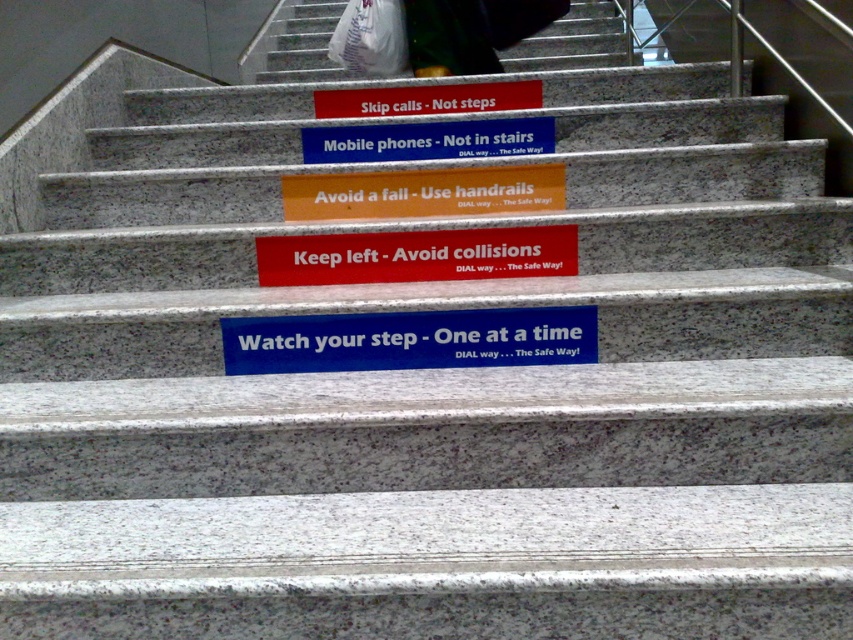
Question: Can you confirm if orange matte sign at center is positioned below matte plastic sign at upper center?

Choices:
 (A) no
 (B) yes

Answer: (B)

Question: Which object is positioned closest to the red matte sign at center?

Choices:
 (A) blue plastic sign at center
 (B) blue matte sign at center
 (C) orange matte sign at center

Answer: (C)

Question: Is red matte sign at center in front of matte plastic sign at upper center?

Choices:
 (A) no
 (B) yes

Answer: (B)

Question: Estimate the real-world distances between objects in this image. Which object is farther from the red matte sign at center?

Choices:
 (A) matte plastic sign at upper center
 (B) blue matte sign at center
 (C) blue plastic sign at center
 (D) orange matte sign at center

Answer: (A)

Question: Does red matte sign at center appear on the left side of matte plastic sign at upper center?

Choices:
 (A) no
 (B) yes

Answer: (B)

Question: Considering the real-world distances, which object is farthest from the red matte sign at center?

Choices:
 (A) blue plastic sign at center
 (B) orange matte sign at center

Answer: (A)